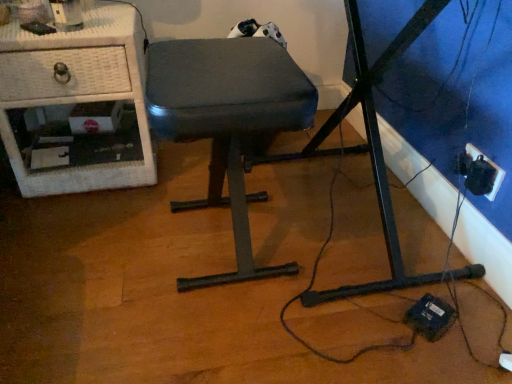
Question: Is white wicker nightstand at left surrounding black plastic outlet at lower right?

Choices:
 (A) no
 (B) yes

Answer: (A)

Question: Is there a large distance between white wicker nightstand at left and black plastic outlet at lower right?

Choices:
 (A) no
 (B) yes

Answer: (B)

Question: Is white wicker nightstand at left at the right side of black plastic outlet at lower right?

Choices:
 (A) yes
 (B) no

Answer: (B)

Question: From the image's perspective, is white wicker nightstand at left under black plastic outlet at lower right?

Choices:
 (A) yes
 (B) no

Answer: (B)

Question: Is white wicker nightstand at left positioned with its back to black plastic outlet at lower right?

Choices:
 (A) no
 (B) yes

Answer: (A)

Question: From the image's perspective, is white wicker nightstand at left located above or below dark gray fabric stool at center?

Choices:
 (A) above
 (B) below

Answer: (A)

Question: Is white wicker nightstand at left in front of or behind dark gray fabric stool at center in the image?

Choices:
 (A) behind
 (B) front

Answer: (A)

Question: In terms of size, does white wicker nightstand at left appear bigger or smaller than dark gray fabric stool at center?

Choices:
 (A) big
 (B) small

Answer: (A)

Question: From a real-world perspective, relative to dark gray fabric stool at center, is white wicker nightstand at left vertically above or below?

Choices:
 (A) below
 (B) above

Answer: (A)

Question: From a real-world perspective, relative to black plastic outlet at lower right, is dark gray fabric stool at center vertically above or below?

Choices:
 (A) below
 (B) above

Answer: (B)

Question: From their relative heights in the image, would you say dark gray fabric stool at center is taller or shorter than black plastic outlet at lower right?

Choices:
 (A) tall
 (B) short

Answer: (A)

Question: From the image's perspective, is dark gray fabric stool at center positioned above or below black plastic outlet at lower right?

Choices:
 (A) below
 (B) above

Answer: (B)

Question: In terms of width, does dark gray fabric stool at center look wider or thinner when compared to black plastic outlet at lower right?

Choices:
 (A) wide
 (B) thin

Answer: (A)

Question: From a real-world perspective, is black plastic outlet at lower right positioned above or below white wicker nightstand at left?

Choices:
 (A) above
 (B) below

Answer: (B)

Question: Considering the positions of black plastic outlet at lower right and white wicker nightstand at left in the image, is black plastic outlet at lower right wider or thinner than white wicker nightstand at left?

Choices:
 (A) thin
 (B) wide

Answer: (A)